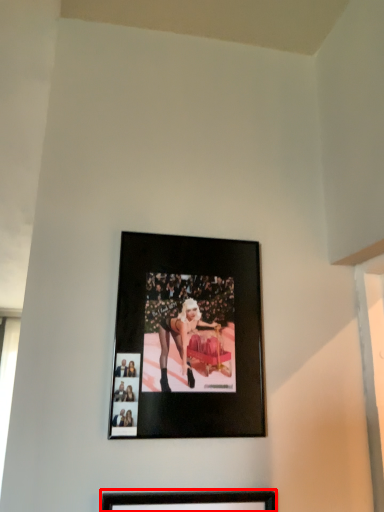
Question: Considering the relative positions of picture frame (annotated by the red box) and picture frame in the image provided, where is picture frame (annotated by the red box) located with respect to the staircase?

Choices:
 (A) left
 (B) right

Answer: (A)